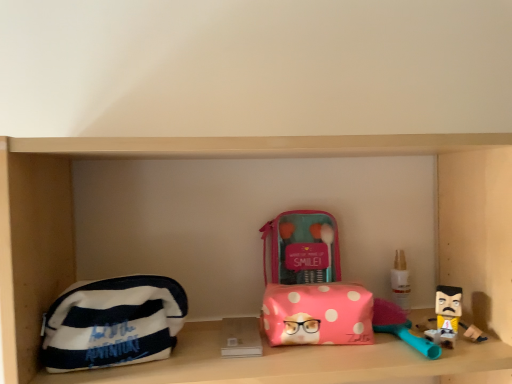
Question: Considering the relative sizes of pink polka dot pouch at center, which is the first pouch in right-to-left order, and white plastic bottle at right in the image provided, is pink polka dot pouch at center, which is the first pouch in right-to-left order, smaller than white plastic bottle at right?

Choices:
 (A) no
 (B) yes

Answer: (A)

Question: From a real-world perspective, is pink polka dot pouch at center, which is the first pouch in right-to-left order, on top of white plastic bottle at right?

Choices:
 (A) yes
 (B) no

Answer: (B)

Question: Is pink polka dot pouch at center, which is the first pouch in right-to-left order, beside white plastic bottle at right?

Choices:
 (A) yes
 (B) no

Answer: (B)

Question: Are pink polka dot pouch at center, which ranks as the second pouch in left-to-right order, and white plastic bottle at right located far from each other?

Choices:
 (A) no
 (B) yes

Answer: (A)

Question: Considering the relative positions of pink polka dot pouch at center, which is the first pouch in right-to-left order, and white plastic bottle at right in the image provided, is pink polka dot pouch at center, which is the first pouch in right-to-left order, to the right of white plastic bottle at right from the viewer's perspective?

Choices:
 (A) no
 (B) yes

Answer: (A)

Question: Is point (46, 344) positioned closer to the camera than point (352, 294)?

Choices:
 (A) farther
 (B) closer

Answer: (B)

Question: From the image's perspective, relative to pink polka dot pouch at center, which ranks as the second pouch in left-to-right order, is white striped fabric pouch at left, which ranks as the second pouch in right-to-left order, above or below?

Choices:
 (A) above
 (B) below

Answer: (A)

Question: From a real-world perspective, is white striped fabric pouch at left, the 1th pouch from the left, above or below pink polka dot pouch at center, which ranks as the second pouch in left-to-right order?

Choices:
 (A) below
 (B) above

Answer: (B)

Question: Considering the positions of white striped fabric pouch at left, which ranks as the second pouch in right-to-left order, and pink polka dot pouch at center, which ranks as the second pouch in left-to-right order, in the image, is white striped fabric pouch at left, which ranks as the second pouch in right-to-left order, bigger or smaller than pink polka dot pouch at center, which ranks as the second pouch in left-to-right order,?

Choices:
 (A) small
 (B) big

Answer: (B)

Question: Does point (111, 283) appear closer or farther from the camera than point (295, 264)?

Choices:
 (A) farther
 (B) closer

Answer: (B)

Question: Relative to pink fabric makeup kit at center, is white striped fabric pouch at left, the 1th pouch from the left, in front or behind?

Choices:
 (A) behind
 (B) front

Answer: (B)

Question: Is white striped fabric pouch at left, which ranks as the second pouch in right-to-left order, to the left or to the right of pink fabric makeup kit at center in the image?

Choices:
 (A) right
 (B) left

Answer: (B)

Question: Would you say white striped fabric pouch at left, which ranks as the second pouch in right-to-left order, is inside or outside pink fabric makeup kit at center?

Choices:
 (A) outside
 (B) inside

Answer: (A)

Question: Relative to white plastic bottle at right, is white striped fabric pouch at left, the 1th pouch from the left, in front or behind?

Choices:
 (A) behind
 (B) front

Answer: (B)

Question: From a real-world perspective, is white striped fabric pouch at left, the 1th pouch from the left, physically located above or below white plastic bottle at right?

Choices:
 (A) above
 (B) below

Answer: (B)